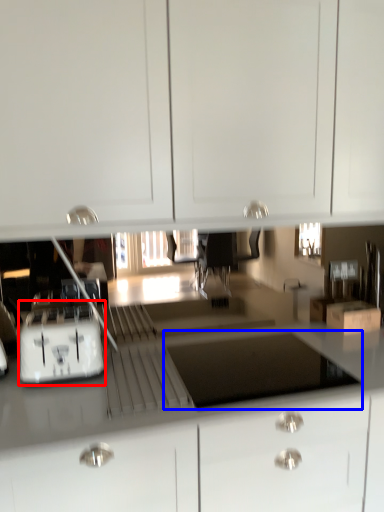
Question: Which point is closer to the camera, home appliance (highlighted by a red box) or appliance (highlighted by a blue box)?

Choices:
 (A) home appliance
 (B) appliance

Answer: (B)